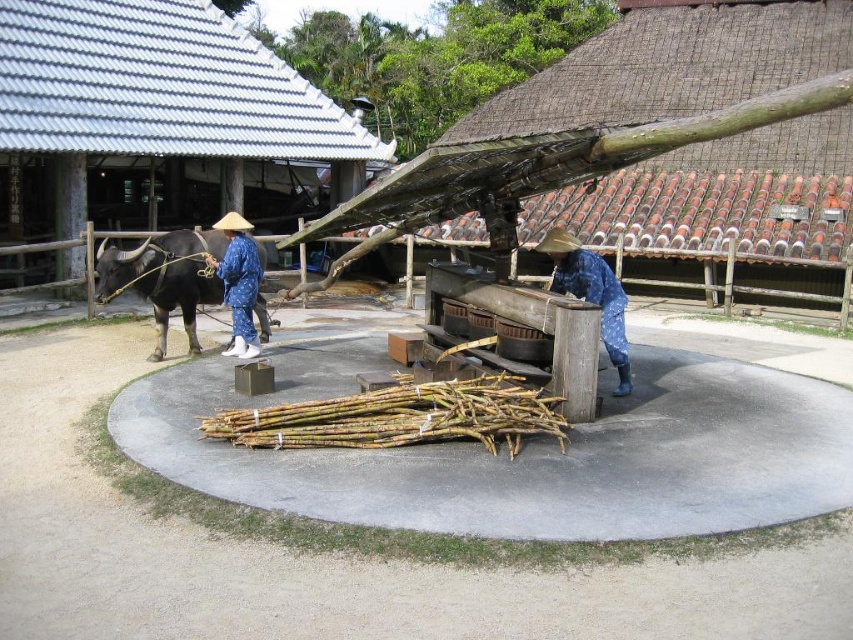
Does brown glossy bull at left have a smaller size compared to blue fabric hat at center?

No, brown glossy bull at left is not smaller than blue fabric hat at center.

Which is above, brown glossy bull at left or blue fabric hat at center?

brown glossy bull at left is above.

Is point (202, 300) positioned in front of point (228, 246)?

That is False.

Where is `brown glossy bull at left`? This screenshot has width=853, height=640. brown glossy bull at left is located at coordinates (164, 276).

Who is lower down, brown glossy bull at left or blue dotted fabric at center?

blue dotted fabric at center is lower down.

Who is more distant from viewer, (164, 288) or (560, 228)?

Point (560, 228)

Where is `brown glossy bull at left`? The width and height of the screenshot is (853, 640). brown glossy bull at left is located at coordinates (164, 276).

Who is higher up, brown rough sugar cane at center or blue dotted fabric at center?

blue dotted fabric at center is above.

What do you see at coordinates (520, 452) in the screenshot? The height and width of the screenshot is (640, 853). I see `brown rough sugar cane at center` at bounding box center [520, 452].

Identify the location of brown rough sugar cane at center. (520, 452).